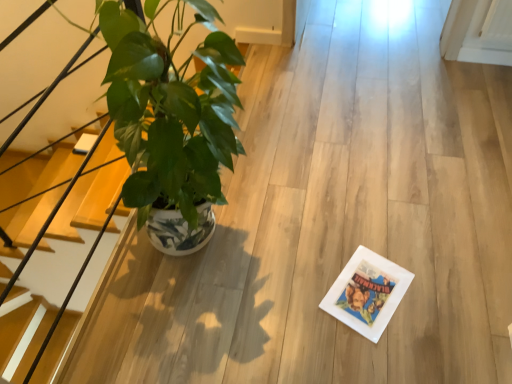
Question: Does green glossy plant at left have a greater width compared to wooden at left?

Choices:
 (A) no
 (B) yes

Answer: (B)

Question: Is green glossy plant at left at the left side of wooden at left?

Choices:
 (A) no
 (B) yes

Answer: (A)

Question: Is wooden at left at the back of green glossy plant at left?

Choices:
 (A) yes
 (B) no

Answer: (A)

Question: Considering the relative sizes of green glossy plant at left and wooden at left in the image provided, is green glossy plant at left smaller than wooden at left?

Choices:
 (A) yes
 (B) no

Answer: (B)

Question: Does green glossy plant at left turn towards wooden at left?

Choices:
 (A) no
 (B) yes

Answer: (A)

Question: Considering the relative sizes of green glossy plant at left and wooden at left in the image provided, is green glossy plant at left bigger than wooden at left?

Choices:
 (A) no
 (B) yes

Answer: (B)

Question: Is wooden at left to the left of green glossy plant at left from the viewer's perspective?

Choices:
 (A) yes
 (B) no

Answer: (A)

Question: Does wooden at left contain green glossy plant at left?

Choices:
 (A) yes
 (B) no

Answer: (B)

Question: Is wooden at left thinner than green glossy plant at left?

Choices:
 (A) no
 (B) yes

Answer: (B)

Question: Does wooden at left have a greater height compared to green glossy plant at left?

Choices:
 (A) no
 (B) yes

Answer: (A)

Question: Does wooden at left have a lesser height compared to green glossy plant at left?

Choices:
 (A) no
 (B) yes

Answer: (B)

Question: Is wooden at left at the right side of green glossy plant at left?

Choices:
 (A) no
 (B) yes

Answer: (A)

Question: In terms of size, does wooden at left appear bigger or smaller than green glossy plant at left?

Choices:
 (A) big
 (B) small

Answer: (B)